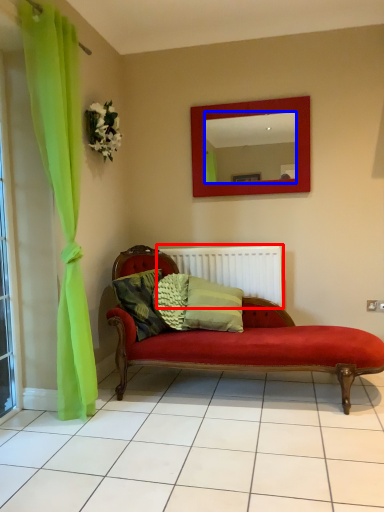
Question: Which object appears farthest to the camera in this image, radiator (highlighted by a red box) or mirror (highlighted by a blue box)?

Choices:
 (A) radiator
 (B) mirror

Answer: (A)